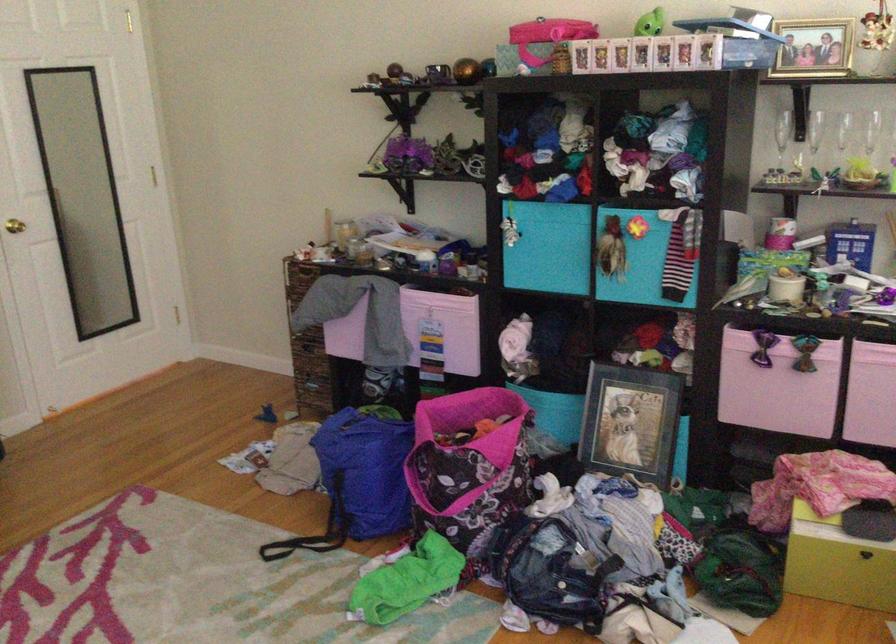
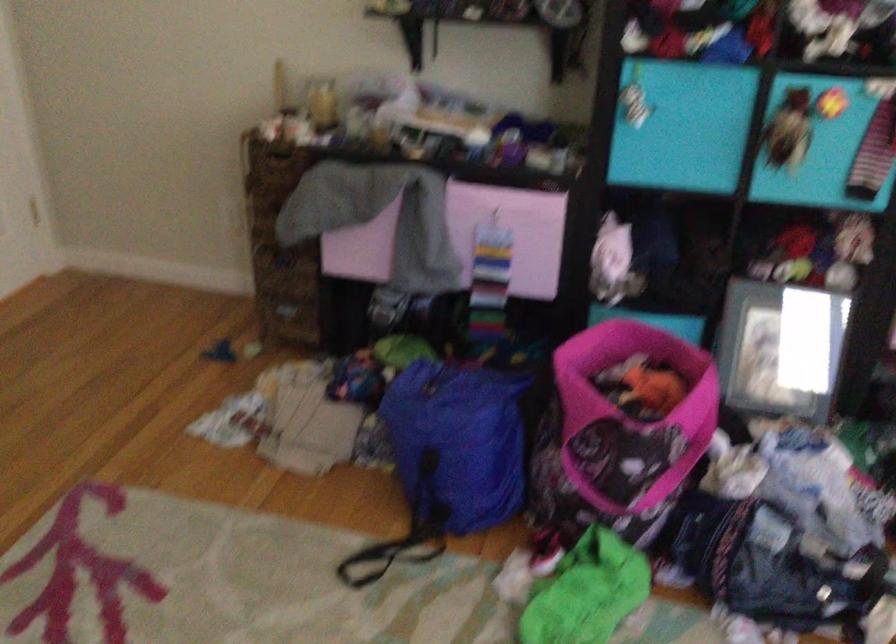
Looking at this image, the images are taken continuously from a first-person perspective. In which direction are you moving?

The cameraman moved toward left, forward.